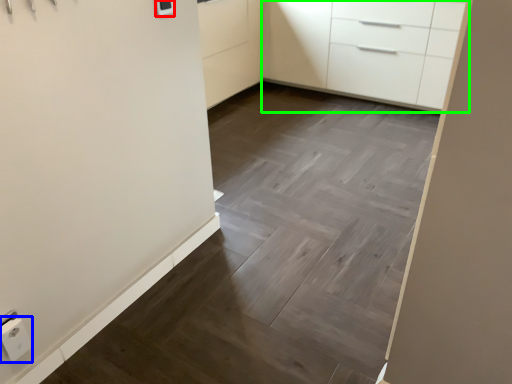
Question: Estimate the real-world distances between objects in this image. Which object is closer to light switch (highlighted by a red box), electric outlet (highlighted by a blue box) or chest of drawers (highlighted by a green box)?

Choices:
 (A) electric outlet
 (B) chest of drawers

Answer: (A)